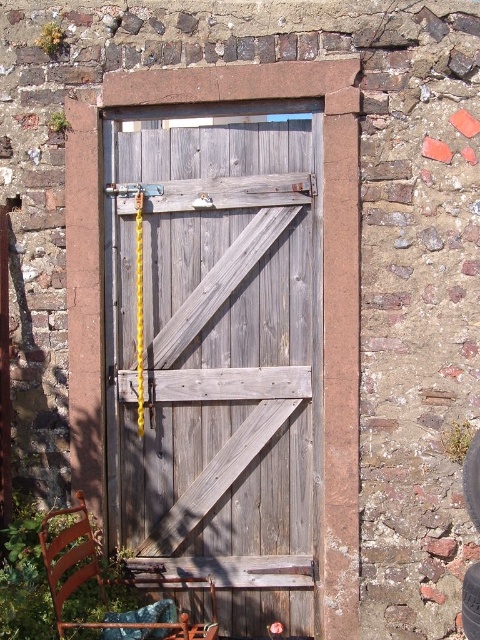
You are a delivery person trying to move a wooden chair at lower left and a black rubber tire at center through a narrow doorway. Which object should you move first to ensure they both fit through the doorway?

You should move the wooden chair at lower left first because it is positioned to the left of the black rubber tire at center, allowing you to maneuver it out of the way before handling the tire.

You are a delivery person trying to deliver a package to the building behind the weathered wood door at center. However, there is a black rubber tire at center blocking the entrance. Can you still access the building through the door?

The black rubber tire at center is behind the weathered wood door at center, so it is not blocking the entrance. You can still access the building through the door.

You are a delivery person trying to deliver a package to the building behind the weathered wood door at center. There is a black rubber tire at center blocking the entrance. Can you enter through the door?

The weathered wood door at center is positioned over black rubber tire at center, meaning the door is above the tire. Since the tire is blocking the entrance, you cannot enter through the door until the tire is removed.